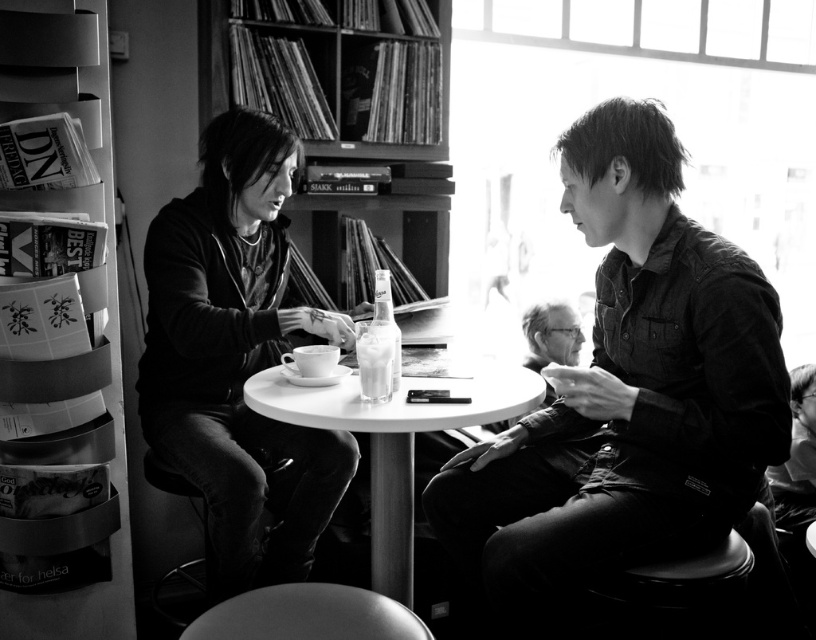
You are standing at the entrance of the cafe and see two points marked on the floor. The first point is at coordinates point (180, 371) and the second point is at point (100, 32). If you want to walk from the entrance to the second point without crossing the first point, which direction should you head towards?

Since point (180, 371) is behind point (100, 32), you should move towards the direction of point (100, 32) while staying in front of point (180, 371) to avoid crossing it.

You are an interior designer assessing the layout of this space. The wooden bookshelf at upper center and the metallic gray bookshelf at left are both in view. Which bookshelf occupies a larger physical space in the room?

The wooden bookshelf at upper center is bigger than the metallic gray bookshelf at left, so it occupies a larger physical space in the room.

You are a photographer trying to capture a detailed shot of the wooden bookshelf at upper center and the denim jacket at right. Since you want both objects in focus, you need to know which one is closer to the camera. Can you determine which object is nearer?

The denim jacket at right is bigger than the wooden bookshelf at upper center, so it is likely closer to the camera since larger objects in a photo are typically nearer.